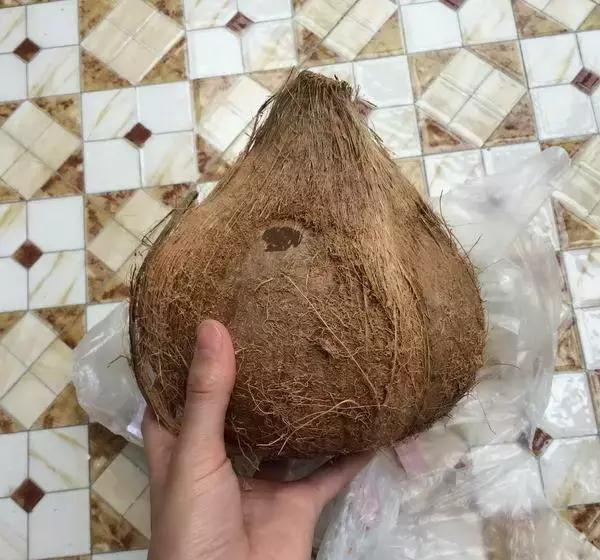
Where is `tiled bench`? This screenshot has width=600, height=560. tiled bench is located at coordinates (143, 88).